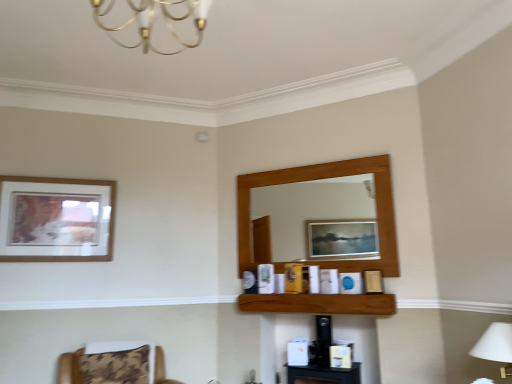
Question: Can you confirm if brown wooden shelf at center is wider than brown fabric chair at lower left?

Choices:
 (A) no
 (B) yes

Answer: (A)

Question: Does brown wooden shelf at center contain brown fabric chair at lower left?

Choices:
 (A) yes
 (B) no

Answer: (B)

Question: Does brown wooden shelf at center have a smaller size compared to brown fabric chair at lower left?

Choices:
 (A) yes
 (B) no

Answer: (A)

Question: Does brown wooden shelf at center have a greater height compared to brown fabric chair at lower left?

Choices:
 (A) no
 (B) yes

Answer: (A)

Question: Is brown wooden shelf at center thinner than brown fabric chair at lower left?

Choices:
 (A) no
 (B) yes

Answer: (B)

Question: Is brown wooden shelf at center far from brown fabric chair at lower left?

Choices:
 (A) yes
 (B) no

Answer: (A)

Question: Is white fabric lampshade at lower right inside wooden picture frame at upper left?

Choices:
 (A) yes
 (B) no

Answer: (B)

Question: Does wooden picture frame at upper left appear on the right side of white fabric lampshade at lower right?

Choices:
 (A) yes
 (B) no

Answer: (B)

Question: From the image's perspective, does wooden picture frame at upper left appear higher than white fabric lampshade at lower right?

Choices:
 (A) yes
 (B) no

Answer: (A)

Question: Is wooden picture frame at upper left not inside white fabric lampshade at lower right?

Choices:
 (A) no
 (B) yes

Answer: (B)

Question: Is wooden picture frame at upper left next to white fabric lampshade at lower right?

Choices:
 (A) no
 (B) yes

Answer: (A)

Question: Is white fabric lampshade at lower right at the back of wooden picture frame at upper left?

Choices:
 (A) no
 (B) yes

Answer: (A)

Question: Is the depth of brown fabric chair at lower left greater than that of gold metallic chandelier at upper center?

Choices:
 (A) no
 (B) yes

Answer: (B)